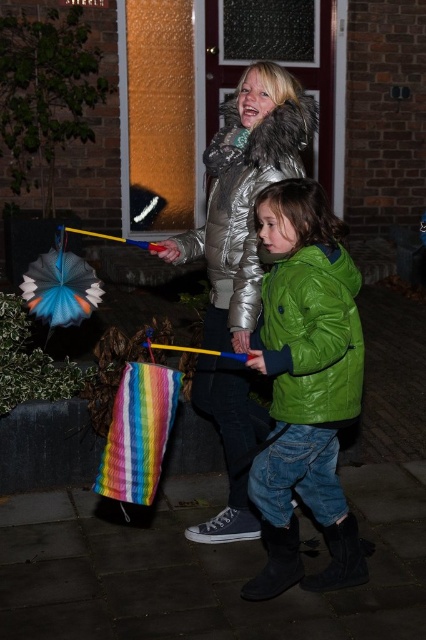
You are a parent trying to take a photo of your kids playing with their toys. You want to ensure both the green matte jacket at center and the multicolored fabric umbrella at center are clearly visible in the frame. Based on their sizes, which object might appear larger in the photo?

The green matte jacket at center is taller than the multicolored fabric umbrella at center, so it will appear larger in the photo.